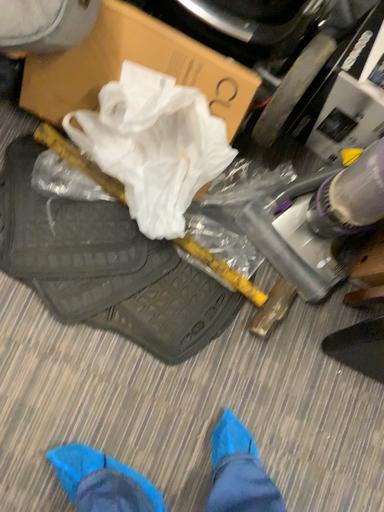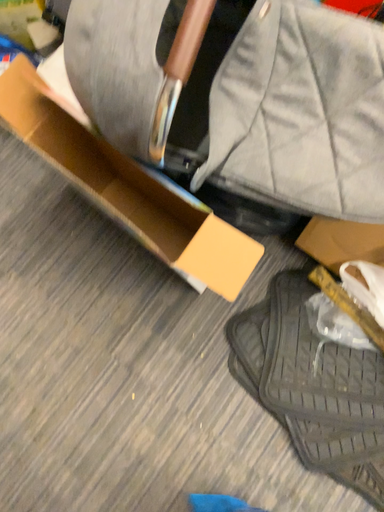
Question: Which way did the camera rotate in the video?

Choices:
 (A) rotated right
 (B) rotated left

Answer: (B)